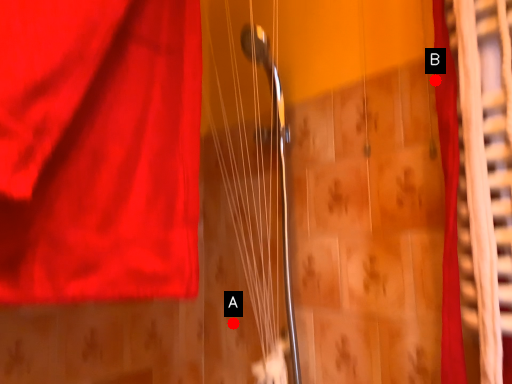
Question: Two points are circled on the image, labeled by A and B beside each circle. Which point appears closest to the camera in this image?

Choices:
 (A) A is closer
 (B) B is closer

Answer: (B)